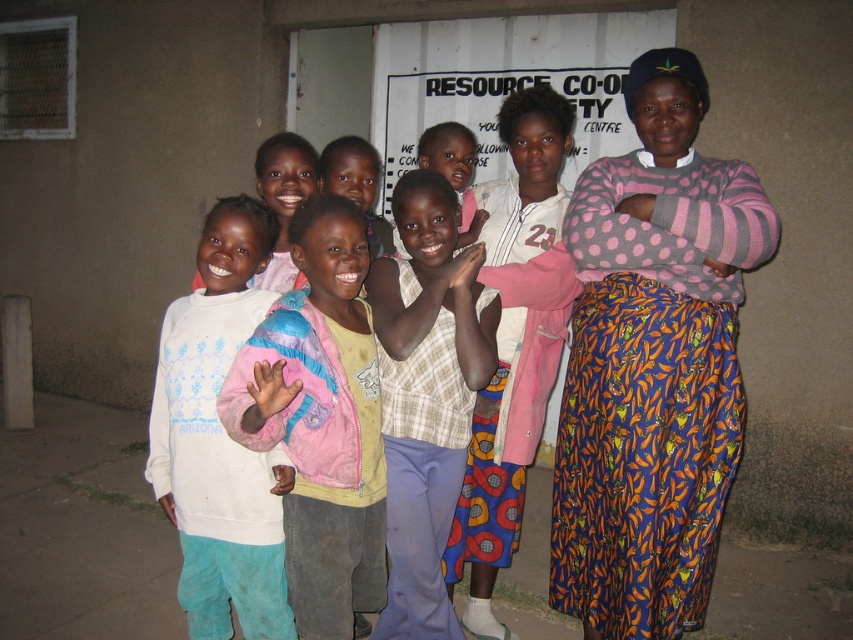
You are a photographer trying to focus on the polka dot sweater at center. Based on the coordinates provided, can you determine if the sweater is positioned in the center of the image?

The polka dot sweater at center has coordinates at point [653,364]. Since the center of an image is typically at coordinates [426,320], this sweater is slightly to the right and above the true center of the image.

You are a photographer trying to capture a group shot of the children and the adult. You notice two clothing items at the center of the image, the polka dot sweater at center and the white fleece sweatshirt at center. Which clothing item should you focus on to ensure it takes up more space in the photo?

The polka dot sweater at center has a greater width than the white fleece sweatshirt at center, so focusing on it will ensure it takes up more space in the photo.

You are a photographer trying to adjust the composition of the image. You want to ensure that the light blue cotton pants at center and the white fleece sweatshirt at center are aligned properly. Which object should be moved to the left to create symmetry?

To create symmetry between the light blue cotton pants at center and the white fleece sweatshirt at center, the light blue cotton pants at center should be moved to the left since it is currently positioned on the right side of the white fleece sweatshirt at center.